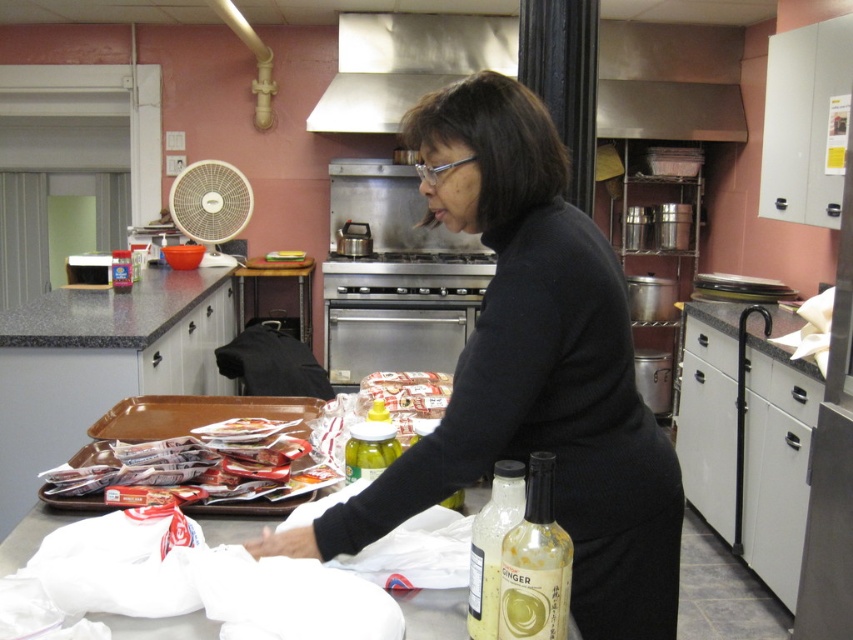
Question: Can you confirm if stainless steel exhaust hood at upper center is bigger than translucent glass ginger syrup at center?

Choices:
 (A) yes
 (B) no

Answer: (A)

Question: Which of the following is the closest to the observer?

Choices:
 (A) (532, 524)
 (B) (289, 499)
 (C) (474, 461)
 (D) (343, 13)

Answer: (A)

Question: Which object is closer to the camera taking this photo?

Choices:
 (A) translucent glass ginger syrup at center
 (B) stainless steel exhaust hood at upper center

Answer: (A)

Question: Can you confirm if granite gray counter at center is smaller than shiny plastic tray at lower left?

Choices:
 (A) no
 (B) yes

Answer: (A)

Question: Is stainless steel exhaust hood at upper center bigger than translucent glass ginger syrup at center?

Choices:
 (A) yes
 (B) no

Answer: (A)

Question: Which object appears closest to the camera in this image?

Choices:
 (A) black matte sweater at center
 (B) stainless steel exhaust hood at upper center
 (C) shiny plastic tray at lower left

Answer: (A)